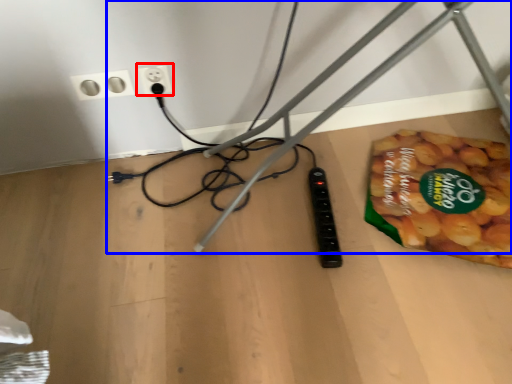
Question: Which object is closer to the camera taking this photo, power plugs and sockets (highlighted by a red box) or wire (highlighted by a blue box)?

Choices:
 (A) power plugs and sockets
 (B) wire

Answer: (B)